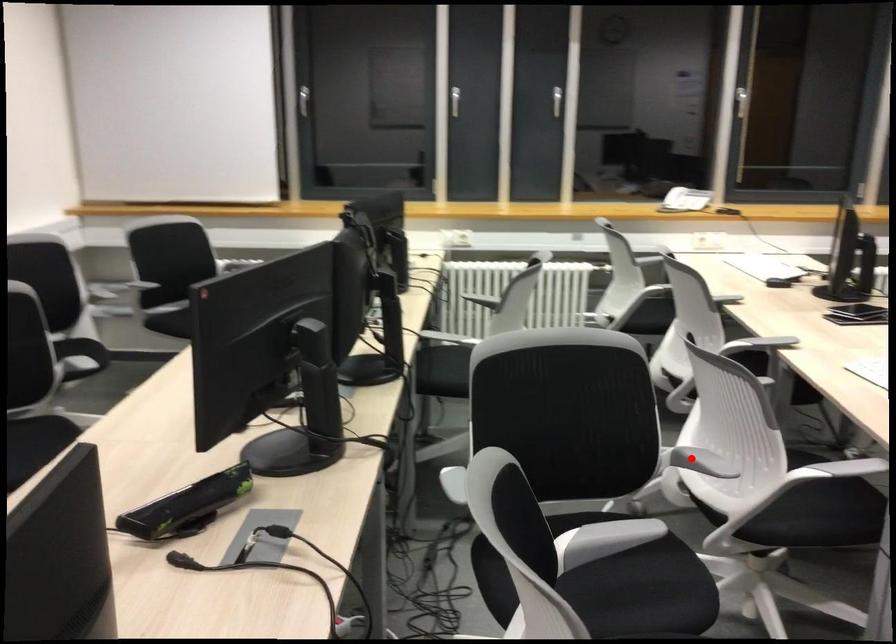
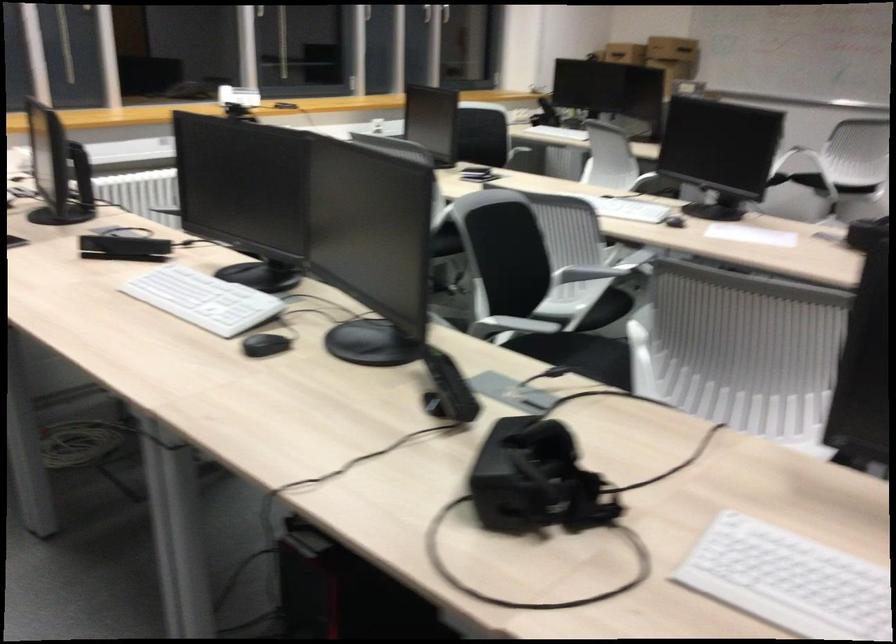
Question: A red point is marked in image1. In image2, is the corresponding 3D point closer to the camera or farther? Reply with the corresponding letter.

Choices:
 (A) The corresponding 3D point is closer.
 (B) The corresponding 3D point is farther.

Answer: (B)